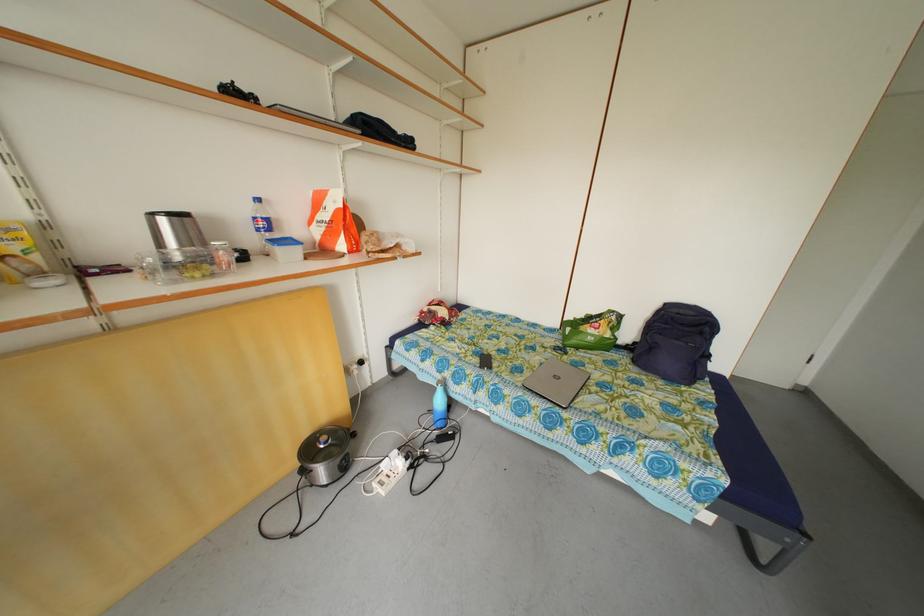
Where is `pot lid handle`? pot lid handle is located at coordinates (323, 436).